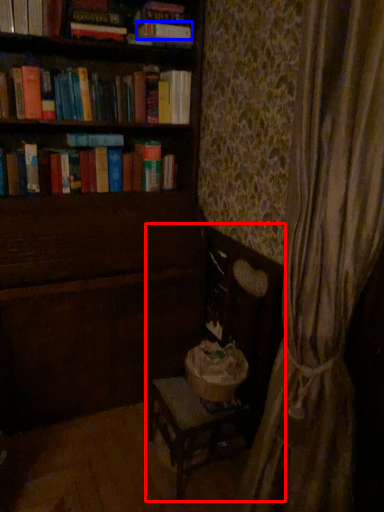
Question: Which object appears farthest to the camera in this image, rocking chair (highlighted by a red box) or paperback book (highlighted by a blue box)?

Choices:
 (A) rocking chair
 (B) paperback book

Answer: (B)